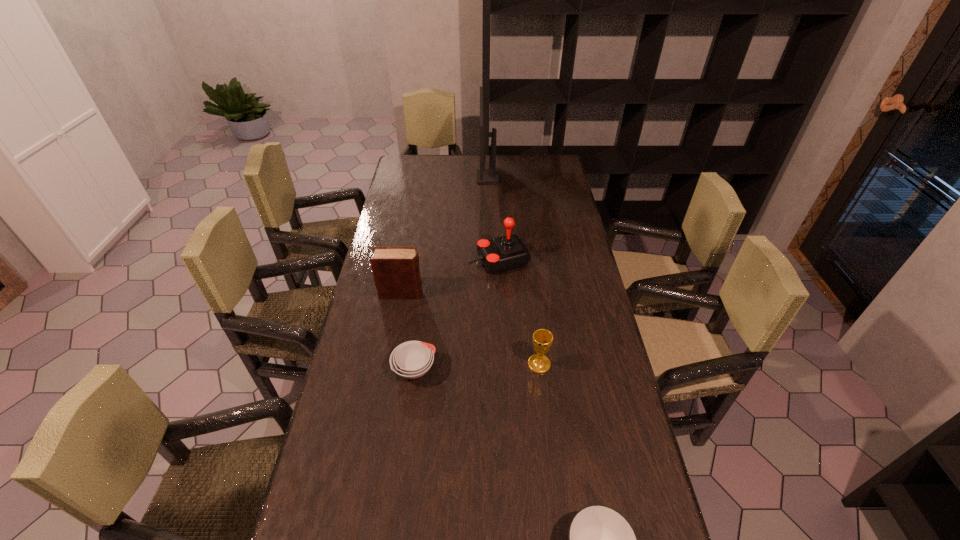
The height and width of the screenshot is (540, 960). I want to click on free space located on the back of the fifth nearest object, so click(497, 212).

Find the location of `free space located on the spine side of the diary`. free space located on the spine side of the diary is located at coordinates (488, 293).

In order to click on free location located 0.190m on the left of the third shortest object in this screenshot , I will do `click(463, 364)`.

Locate an element on the screen. This screenshot has height=540, width=960. vacant area situated 0.230m on the back of the shortest object is located at coordinates (423, 297).

This screenshot has height=540, width=960. In order to click on object present at the far edge in this screenshot , I will do `click(484, 176)`.

This screenshot has width=960, height=540. What are the coordinates of `diary positioned at the left edge` in the screenshot? It's located at (396, 271).

Identify the location of soup bowl at the left edge. (412, 359).

Identify the location of free point at the far edge. (520, 159).

This screenshot has width=960, height=540. I want to click on free spot at the left edge of the desktop, so click(x=357, y=459).

Where is `free location at the right edge of the desktop`? This screenshot has width=960, height=540. free location at the right edge of the desktop is located at coordinates (557, 305).